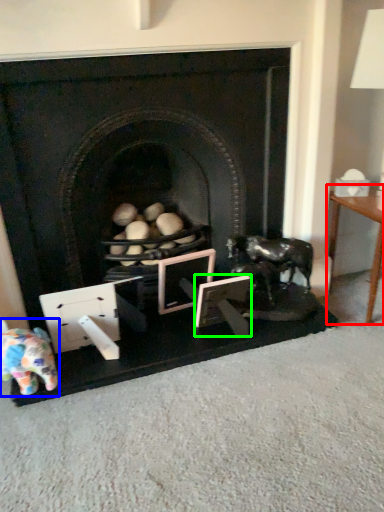
Question: Estimate the real-world distances between objects in this image. Which object is closer to table (highlighted by a red box), toy (highlighted by a blue box) or picture frame (highlighted by a green box)?

Choices:
 (A) toy
 (B) picture frame

Answer: (B)